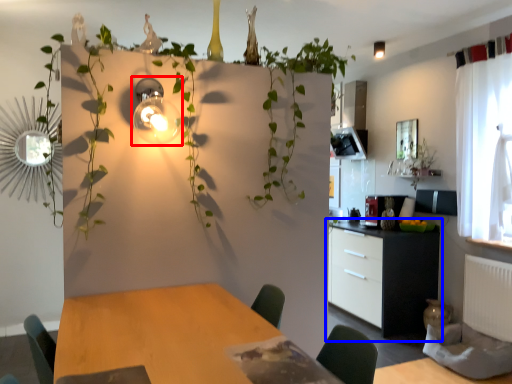
Question: Which object is closer to the camera taking this photo, light fixture (highlighted by a red box) or cabinetry (highlighted by a blue box)?

Choices:
 (A) light fixture
 (B) cabinetry

Answer: (A)